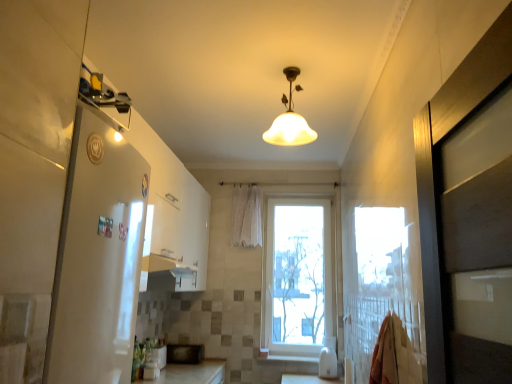
In order to click on free space above white glossy wood at lower center (from a real-world perspective) in this screenshot , I will do `click(297, 351)`.